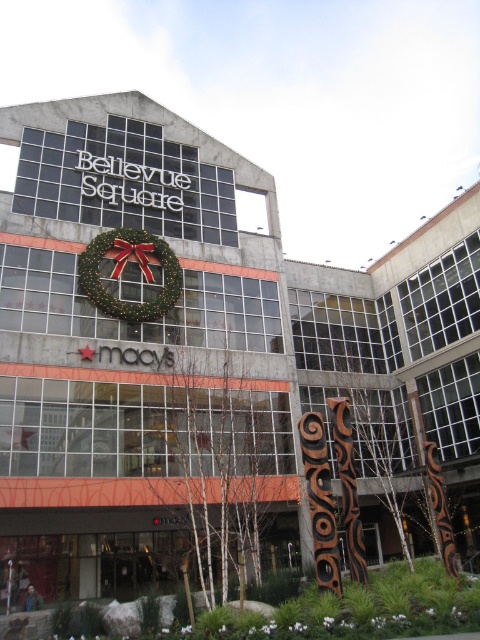
From the picture: Does brown carved wood totem pole at center have a greater height compared to green matte wreath at center?

Indeed, brown carved wood totem pole at center has a greater height compared to green matte wreath at center.

The image size is (480, 640). What do you see at coordinates (320, 500) in the screenshot?
I see `brown carved wood totem pole at center` at bounding box center [320, 500].

Find the location of a particular element. This screenshot has width=480, height=640. brown carved wood totem pole at center is located at coordinates (320, 500).